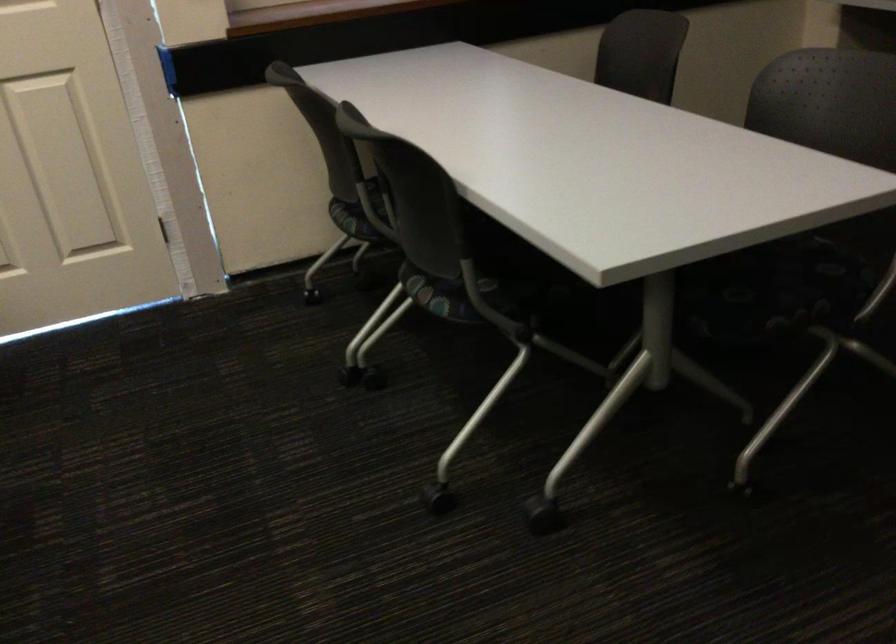
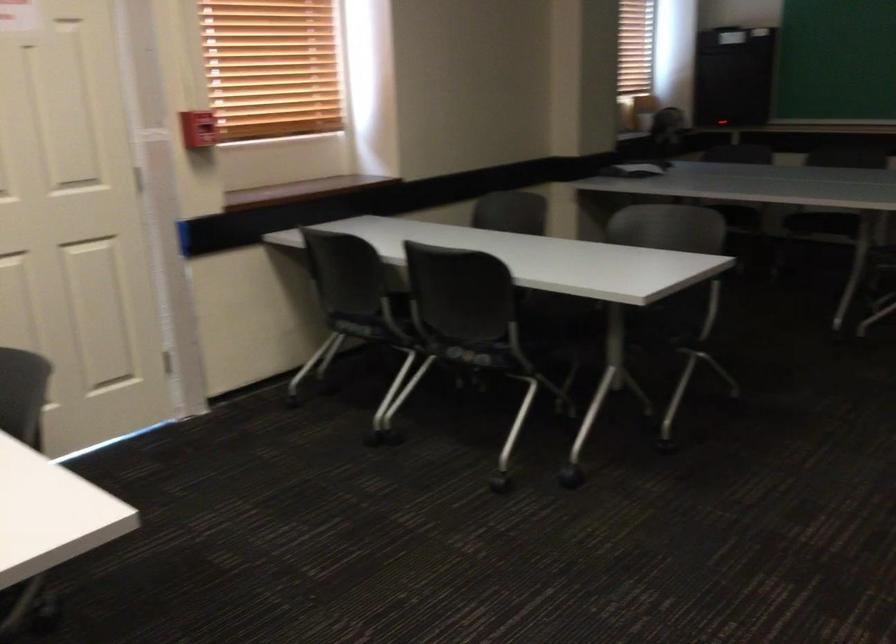
In the second image, find the point that corresponds to [745,313] in the first image.

(657, 337)